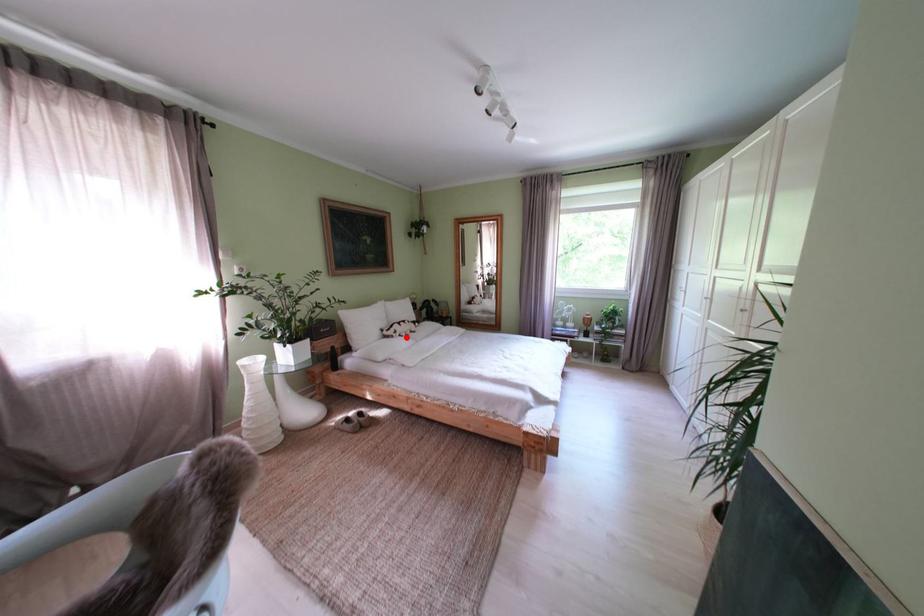
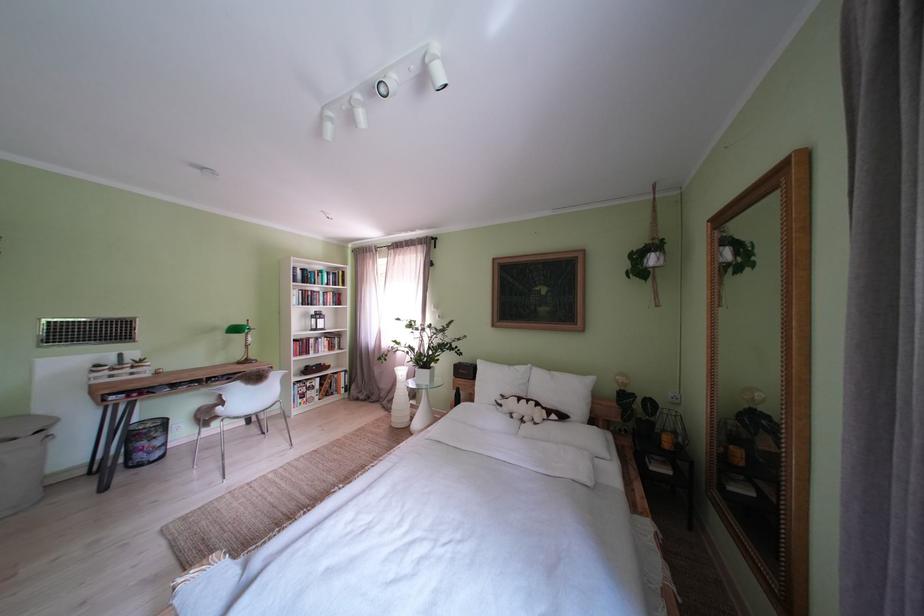
Find the pixel in the second image that matches the highlighted location in the first image.

(512, 411)